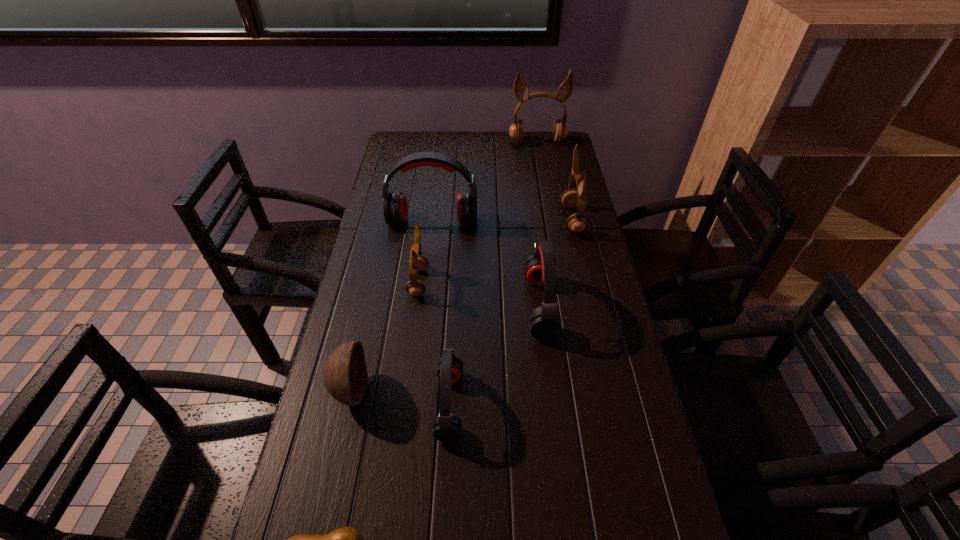
This screenshot has width=960, height=540. I want to click on bowl, so click(x=345, y=375).

You are a GUI agent. You are given a task and a screenshot of the screen. Output one action in this format:
    pyautogui.click(x=<x>, y=<y>)
    Task: Click on the free point located 0.070m on the front-facing side of the tallest earphone
    The width and height of the screenshot is (960, 540).
    Given the screenshot: What is the action you would take?
    pyautogui.click(x=540, y=157)

Where is `vacant space located 0.380m on the ear cups of the biggest red earphone`? vacant space located 0.380m on the ear cups of the biggest red earphone is located at coordinates click(x=421, y=322).

Where is `vacant space located 0.300m on the front-facing side of the second biggest brown earphone`? vacant space located 0.300m on the front-facing side of the second biggest brown earphone is located at coordinates (471, 220).

Where is `free space located 0.210m on the front-facing side of the second biggest brown earphone`? The width and height of the screenshot is (960, 540). free space located 0.210m on the front-facing side of the second biggest brown earphone is located at coordinates (498, 220).

Find the location of `vacant space positioned on the front-facing side of the second biggest brown earphone`. vacant space positioned on the front-facing side of the second biggest brown earphone is located at coordinates (457, 220).

Find the location of a particular element. free space located on the ear cups of the rightmost red earphone is located at coordinates (465, 306).

At what (x,y) coordinates should I click in order to perform the action: click on free space located on the ear cups of the rightmost red earphone. Please return your answer as a coordinate pair (x, y). The width and height of the screenshot is (960, 540). Looking at the image, I should click on (453, 306).

Locate an element on the screen. The height and width of the screenshot is (540, 960). free location located 0.250m on the ear cups of the rightmost red earphone is located at coordinates (435, 306).

You are a GUI agent. You are given a task and a screenshot of the screen. Output one action in this format:
    pyautogui.click(x=<x>, y=<y>)
    Task: Click on the free region located 0.200m on the front-facing side of the nearest brown earphone
    
    Given the screenshot: What is the action you would take?
    pyautogui.click(x=497, y=282)